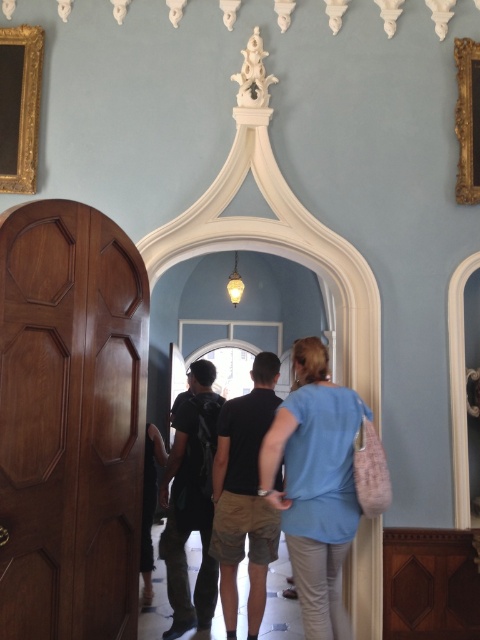
Does black fabric backpack at center have a larger size compared to gold wood picture frame at right?

Yes.

Where is `black fabric backpack at center`? This screenshot has width=480, height=640. black fabric backpack at center is located at coordinates (191, 502).

This screenshot has height=640, width=480. I want to click on black fabric backpack at center, so click(191, 502).

Locate an element on the screen. This screenshot has height=640, width=480. black fabric backpack at center is located at coordinates (191, 502).

Between polished wood door at left and gold wood picture frame at right, which one appears on the left side from the viewer's perspective?

From the viewer's perspective, polished wood door at left appears more on the left side.

Does polished wood door at left have a smaller size compared to gold wood picture frame at right?

No.

You are a GUI agent. You are given a task and a screenshot of the screen. Output one action in this format:
    pyautogui.click(x=<x>, y=<y>)
    Task: Click on the polished wood door at left
    
    Given the screenshot: What is the action you would take?
    pyautogui.click(x=70, y=422)

Can you confirm if black fabric backpack at center is positioned to the left of gold ornate frame at upper left?

In fact, black fabric backpack at center is to the right of gold ornate frame at upper left.

Who is more forward, (186, 630) or (25, 29)?

Point (25, 29) is more forward.

Identify the location of black fabric backpack at center. Image resolution: width=480 pixels, height=640 pixels. (191, 502).

Find the location of a particular element. The height and width of the screenshot is (640, 480). black fabric backpack at center is located at coordinates (191, 502).